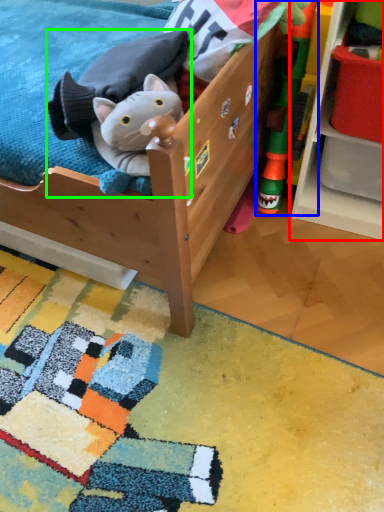
Question: Which is farther away from shelf (highlighted by a red box)? toy (highlighted by a blue box) or toy (highlighted by a green box)?

Choices:
 (A) toy
 (B) toy

Answer: (B)